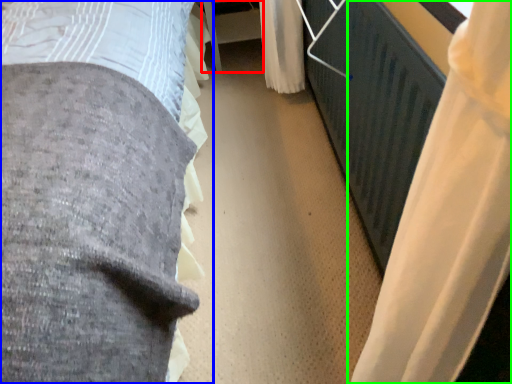
Question: Considering the real-world distances, which object is closest to table (highlighted by a red box)? bed (highlighted by a blue box) or curtain (highlighted by a green box).

Choices:
 (A) bed
 (B) curtain

Answer: (A)